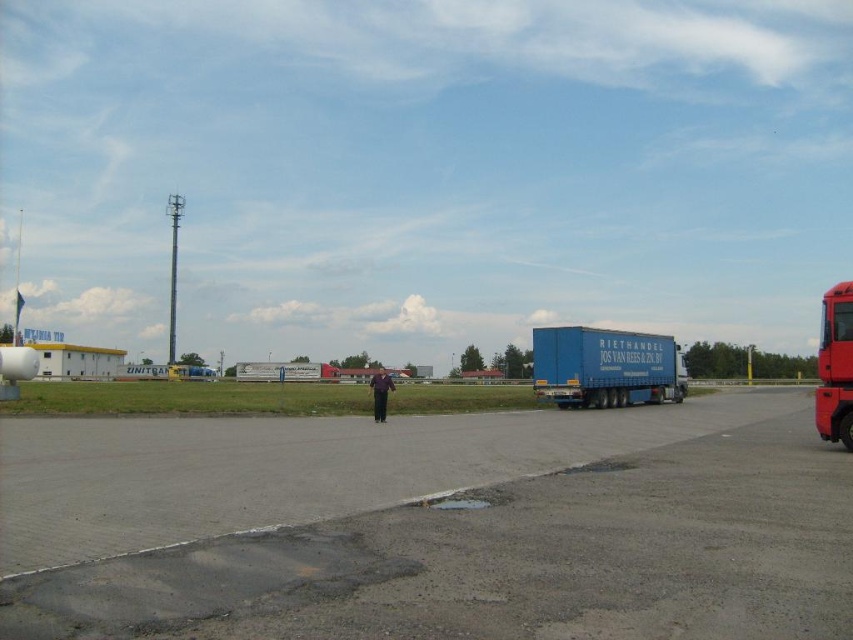
Question: Which object is farther from the camera taking this photo?

Choices:
 (A) blue matte trailer at right
 (B) shiny red truck at right
 (C) asphalt at center

Answer: (A)

Question: Does asphalt at center have a larger size compared to blue matte trailer at right?

Choices:
 (A) no
 (B) yes

Answer: (A)

Question: Observing the image, what is the correct spatial positioning of blue matte trailer at right in reference to shiny red truck at right?

Choices:
 (A) left
 (B) right

Answer: (A)

Question: Among these objects, which one is nearest to the camera?

Choices:
 (A) shiny red truck at right
 (B) blue matte trailer at right

Answer: (A)

Question: Considering the real-world distances, which object is closest to the blue matte trailer at right?

Choices:
 (A) shiny red truck at right
 (B) asphalt at center

Answer: (A)

Question: Does blue matte trailer at right have a lesser width compared to shiny red truck at right?

Choices:
 (A) yes
 (B) no

Answer: (B)